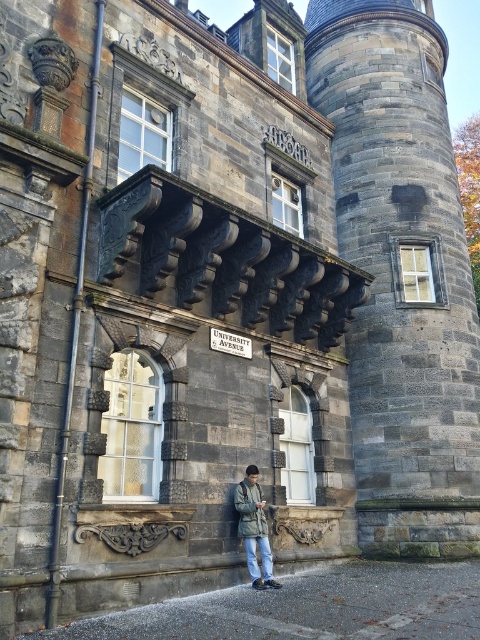
Is dark gray stone tower at center smaller than green matte jacket at center?

Incorrect, dark gray stone tower at center is not smaller in size than green matte jacket at center.

Is dark gray stone tower at center to the right of green matte jacket at center from the viewer's perspective?

Indeed, dark gray stone tower at center is positioned on the right side of green matte jacket at center.

Is point (478, 362) farther from viewer compared to point (255, 566)?

That is True.

Identify the location of dark gray stone tower at center. (402, 275).